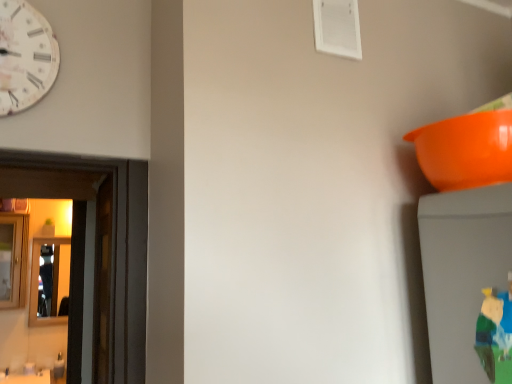
Question: Visually, is wooden mirror at left, which is the first mirror from front to back, positioned to the left or to the right of shiny silver mirror at left, which appears as the 2th mirror when viewed from the front?

Choices:
 (A) right
 (B) left

Answer: (B)

Question: Looking at the image, does wooden mirror at left, the 2th mirror viewed from the back, seem bigger or smaller compared to shiny silver mirror at left, which appears as the 2th mirror when viewed from the front?

Choices:
 (A) big
 (B) small

Answer: (A)

Question: Which object is positioned farthest from the wooden mirror at left, the 2th mirror viewed from the back?

Choices:
 (A) orange plastic bowl at upper right
 (B) shiny silver mirror at left, which appears as the 2th mirror when viewed from the front
 (C) white paper-like clock at upper left
 (D) plush green toy at lower right

Answer: (D)

Question: Estimate the real-world distances between objects in this image. Which object is farther from the plush green toy at lower right?

Choices:
 (A) white paper-like clock at upper left
 (B) wooden mirror at left, the 2th mirror viewed from the back
 (C) shiny silver mirror at left, which appears as the 2th mirror when viewed from the front
 (D) orange plastic bowl at upper right

Answer: (C)